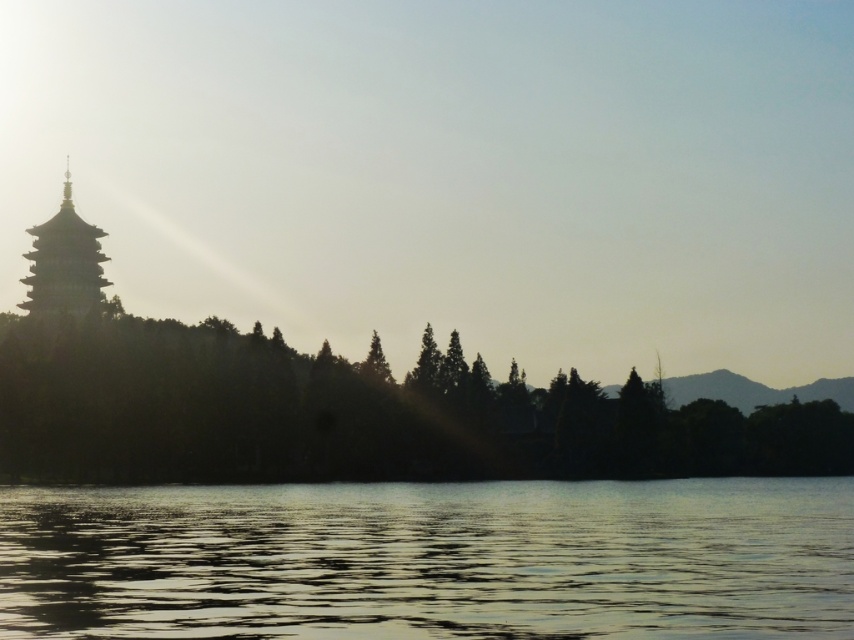
Between silvery reflective water at lower center and matte gray pagoda at left, which one appears on the left side from the viewer's perspective?

matte gray pagoda at left

Can you confirm if silvery reflective water at lower center is wider than matte gray pagoda at left?

Correct, the width of silvery reflective water at lower center exceeds that of matte gray pagoda at left.

Which is behind, point (10, 628) or point (97, 298)?

Positioned behind is point (97, 298).

Locate an element on the screen. silvery reflective water at lower center is located at coordinates (431, 560).

Is silvery reflective water at lower center closer to camera compared to silhouette tree at left?

A: Yes, it is.

You are a GUI agent. You are given a task and a screenshot of the screen. Output one action in this format:
    pyautogui.click(x=<x>, y=<y>)
    Task: Click on the silvery reflective water at lower center
    
    Given the screenshot: What is the action you would take?
    pyautogui.click(x=431, y=560)

Does silhouette tree at left have a lesser width compared to matte gray pagoda at left?

In fact, silhouette tree at left might be wider than matte gray pagoda at left.

Does silhouette tree at left have a greater height compared to matte gray pagoda at left?

No.

Does point (177, 460) lie in front of point (51, 288)?

Yes, point (177, 460) is in front of point (51, 288).

Locate an element on the screen. Image resolution: width=854 pixels, height=640 pixels. silhouette tree at left is located at coordinates (355, 413).